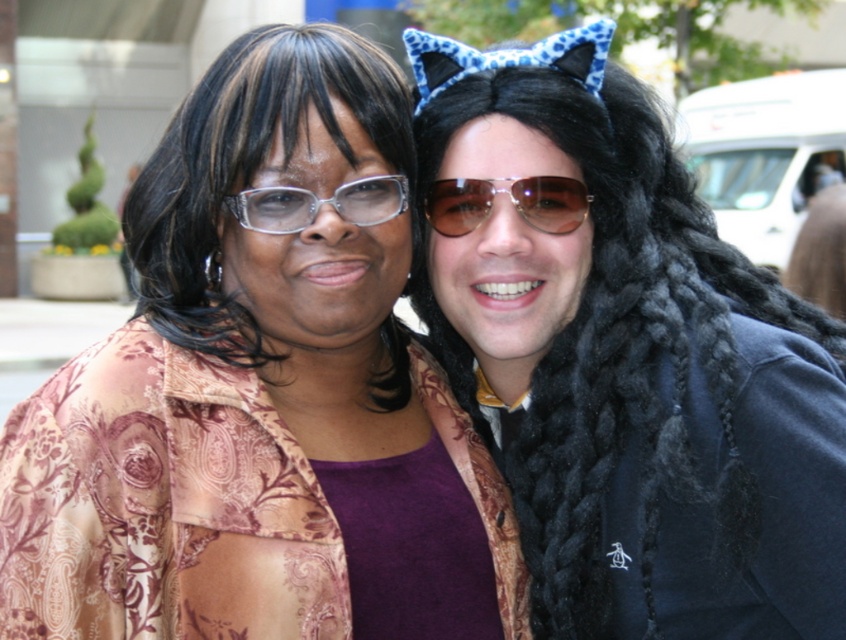
Question: Does brown reflective aviator sunglasses at center have a greater width compared to transparent plastic glasses at center?

Choices:
 (A) yes
 (B) no

Answer: (A)

Question: Estimate the real-world distances between objects in this image. Which object is closer to the transparent plastic glasses at center?

Choices:
 (A) brown reflective aviator sunglasses at center
 (B) black silky hair at upper left
 (C) blue leopard print cat ears at upper center
 (D) black braided wig at right

Answer: (B)

Question: Observing the image, what is the correct spatial positioning of blue leopard print cat ears at upper center in reference to brown reflective aviator sunglasses at center?

Choices:
 (A) right
 (B) left

Answer: (B)

Question: Which is nearer to the brown reflective aviator sunglasses at center?

Choices:
 (A) black silky hair at upper left
 (B) black braided wig at right
 (C) brown paisley jacket at upper left
 (D) blue leopard print cat ears at upper center

Answer: (A)

Question: Does black silky hair at upper left have a lesser width compared to blue leopard print cat ears at upper center?

Choices:
 (A) no
 (B) yes

Answer: (B)

Question: Which object is positioned closest to the transparent plastic glasses at center?

Choices:
 (A) brown reflective aviator sunglasses at center
 (B) black braided wig at right
 (C) brown paisley jacket at upper left

Answer: (A)